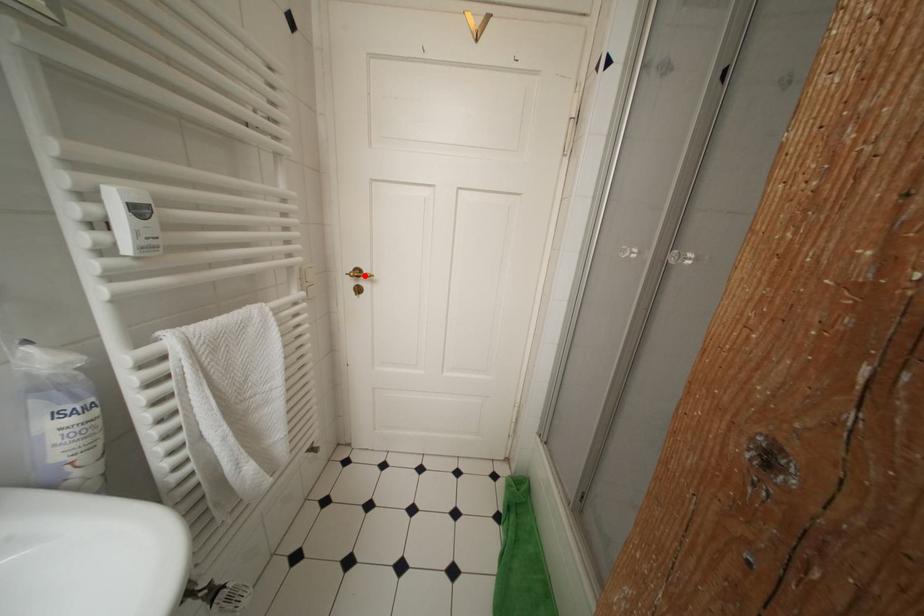
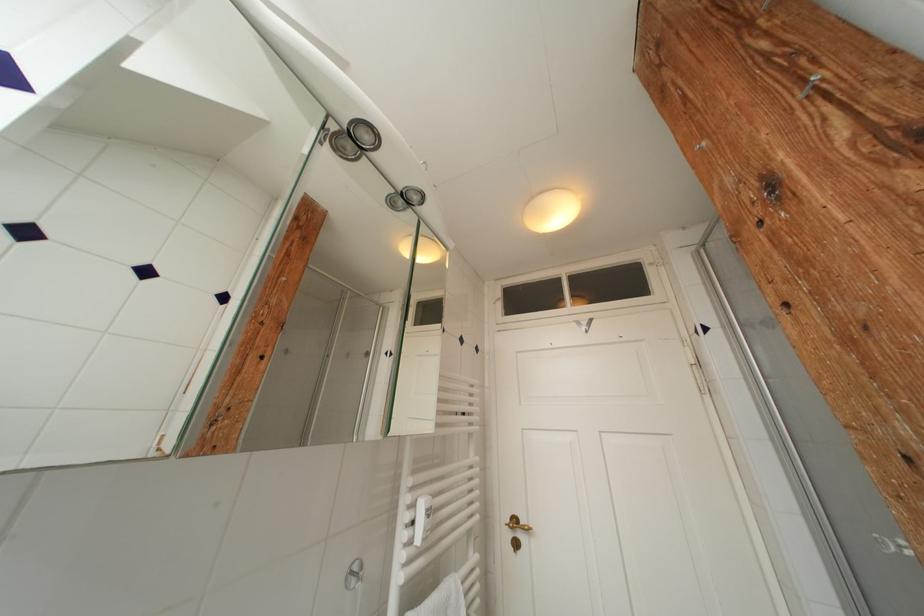
Where in the second image is the point corresponding to the highlighted location from the first image?

(521, 525)